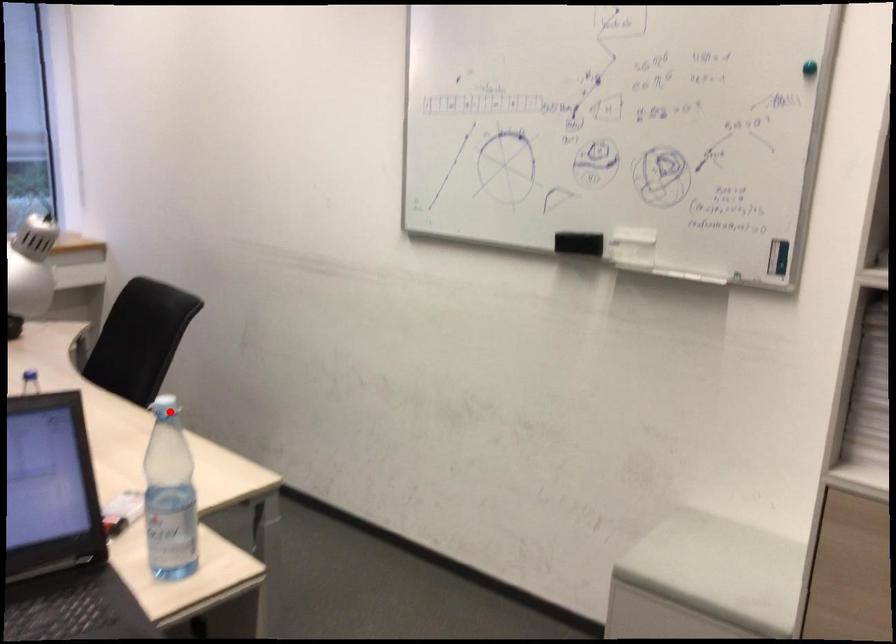
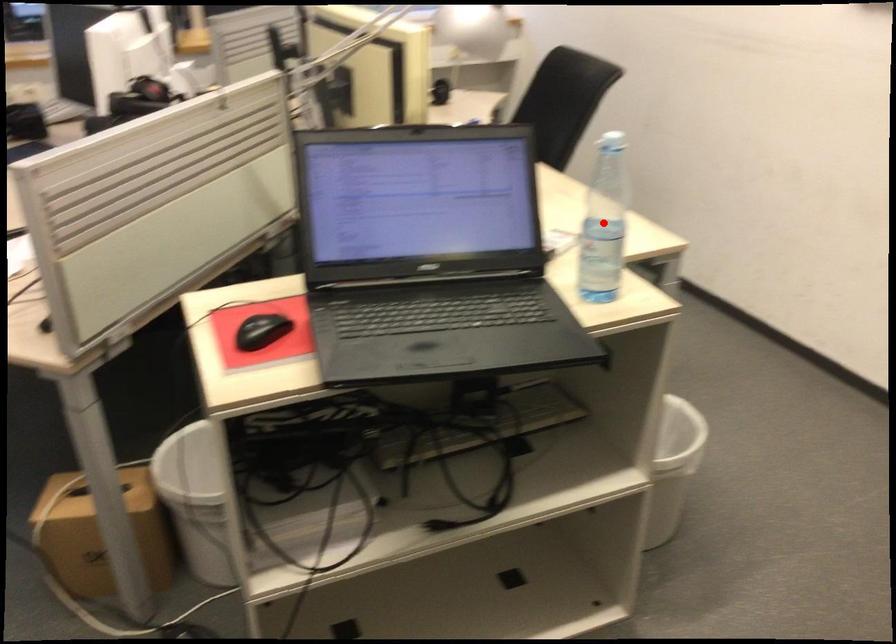
I am providing you with two images of the same scene from different viewpoints. A red point is marked on the first image and another point is marked on the second image. Are the points marked in image1 and image2 representing the same 3D position?

No